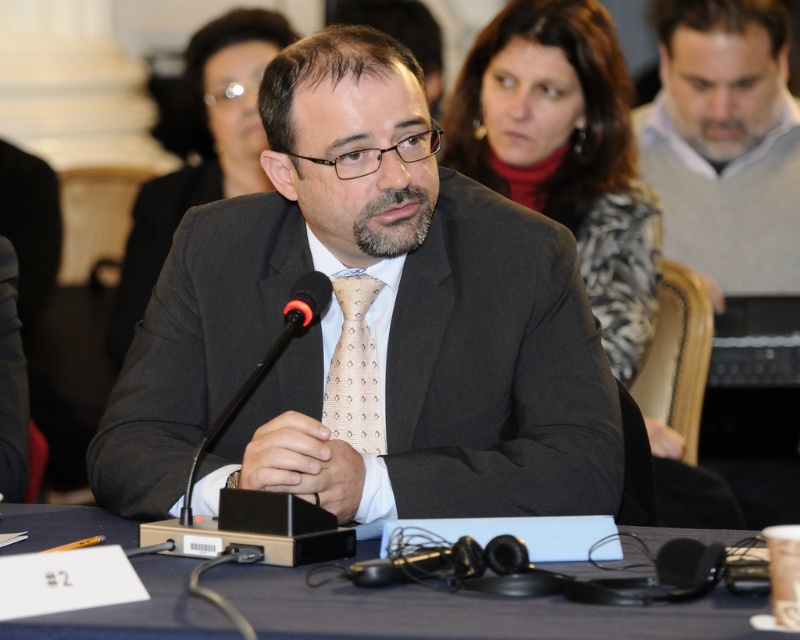
Question: Based on their relative distances, which object is farther from the gray sweater at right?

Choices:
 (A) black plastic microphone at center
 (B) beige dotted tie at center
 (C) blue fabric table at center

Answer: (C)

Question: Is matte black suit at center behind black plastic microphone at center?

Choices:
 (A) yes
 (B) no

Answer: (A)

Question: Does blue fabric table at center appear on the right side of beige dotted tie at center?

Choices:
 (A) no
 (B) yes

Answer: (A)

Question: Which object appears farthest from the camera in this image?

Choices:
 (A) beige dotted tie at center
 (B) blue fabric table at center
 (C) matte black suit at center

Answer: (A)

Question: Can you confirm if matte black suit at center is thinner than gray sweater at right?

Choices:
 (A) no
 (B) yes

Answer: (A)

Question: Which of the following is the closest to the observer?

Choices:
 (A) (244, 385)
 (B) (778, 216)
 (C) (333, 280)

Answer: (A)